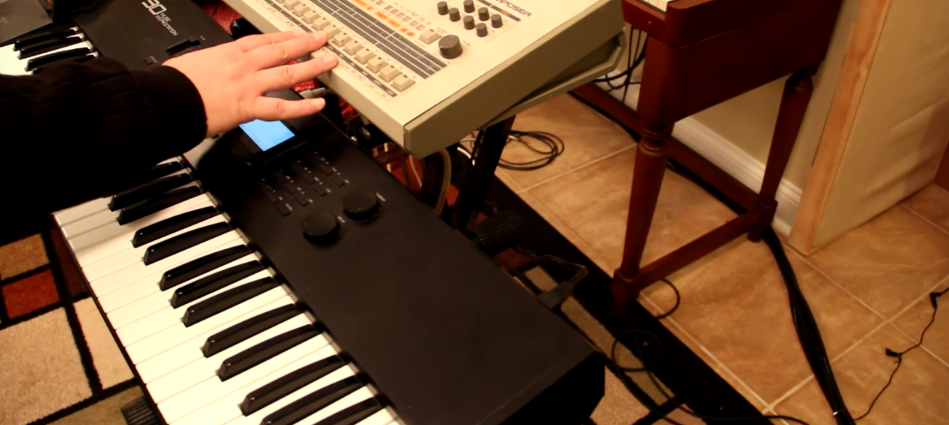
This screenshot has height=425, width=949. What are the coordinates of `wall` in the screenshot? It's located at (749, 122).